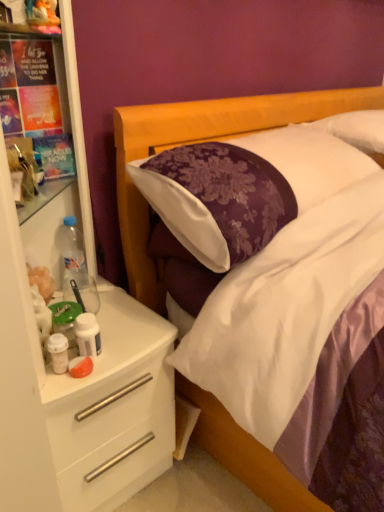
Question: Can you confirm if plush fabric toy at upper left is smaller than white plastic drawer at left?

Choices:
 (A) no
 (B) yes

Answer: (B)

Question: Is plush fabric toy at upper left further to the viewer compared to white plastic drawer at left?

Choices:
 (A) no
 (B) yes

Answer: (B)

Question: From the image's perspective, does plush fabric toy at upper left appear higher than white plastic drawer at left?

Choices:
 (A) no
 (B) yes

Answer: (B)

Question: Considering the relative sizes of plush fabric toy at upper left and white plastic drawer at left in the image provided, is plush fabric toy at upper left bigger than white plastic drawer at left?

Choices:
 (A) yes
 (B) no

Answer: (B)

Question: Is plush fabric toy at upper left shorter than white plastic drawer at left?

Choices:
 (A) yes
 (B) no

Answer: (A)

Question: From the image's perspective, is plush fabric toy at upper left below white plastic drawer at left?

Choices:
 (A) yes
 (B) no

Answer: (B)

Question: Is white glossy bottle at left, marked as the 2th bottle in a back-to-front arrangement, wider than clear plastic bottle at left, which is the second bottle in bottom-to-top order?

Choices:
 (A) yes
 (B) no

Answer: (B)

Question: Is white glossy bottle at left, positioned as the 2th bottle in top-to-bottom order, bigger than clear plastic bottle at left, placed as the 2th bottle when sorted from right to left?

Choices:
 (A) no
 (B) yes

Answer: (A)

Question: Is white glossy bottle at left, the 1th bottle viewed from the front, aimed at clear plastic bottle at left, the first bottle from the top?

Choices:
 (A) yes
 (B) no

Answer: (B)

Question: From a real-world perspective, is white glossy bottle at left, the 1th bottle when ordered from bottom to top, beneath clear plastic bottle at left, placed as the second bottle when sorted from front to back?

Choices:
 (A) no
 (B) yes

Answer: (B)

Question: From the image's perspective, is white glossy bottle at left, the 1th bottle when ordered from bottom to top, located beneath clear plastic bottle at left, placed as the 2th bottle when sorted from right to left?

Choices:
 (A) yes
 (B) no

Answer: (A)

Question: Would you consider white glossy bottle at left, the 1th bottle when ordered from bottom to top, to be distant from clear plastic bottle at left, the first bottle positioned from the back?

Choices:
 (A) no
 (B) yes

Answer: (A)

Question: Considering the relative sizes of white plastic drawer at left and white plastic dresser at left in the image provided, is white plastic drawer at left bigger than white plastic dresser at left?

Choices:
 (A) no
 (B) yes

Answer: (A)